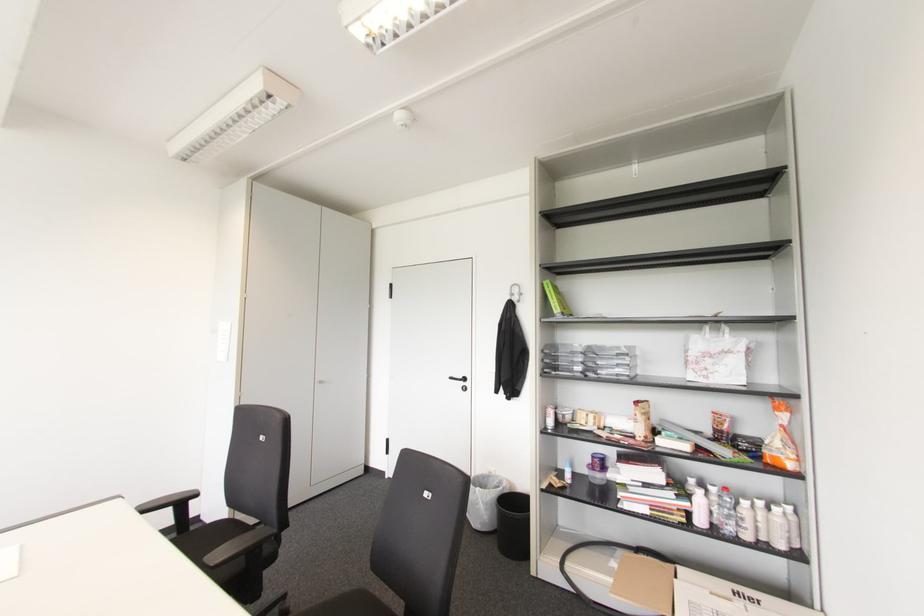
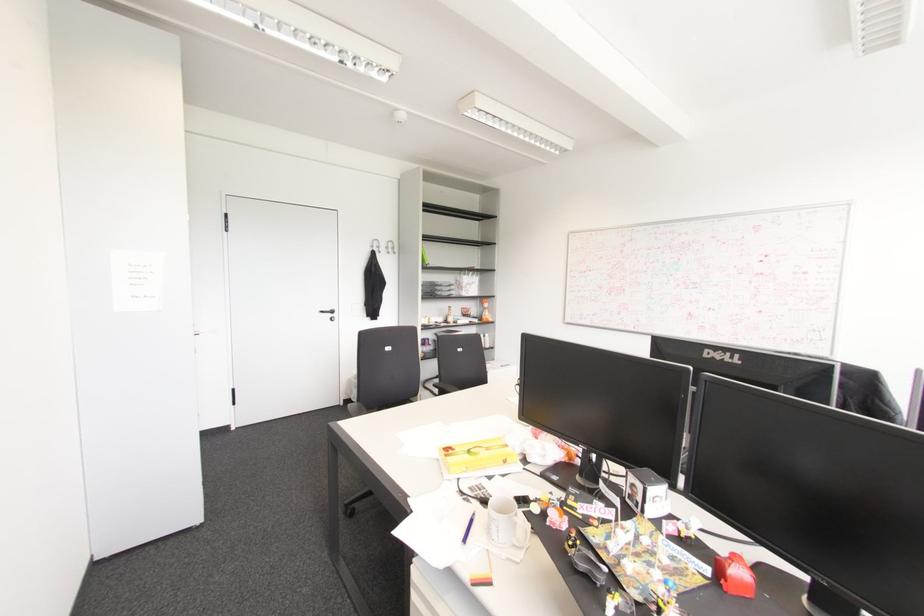
Find the pixel in the second image that matches (783,416) in the first image.

(485, 305)